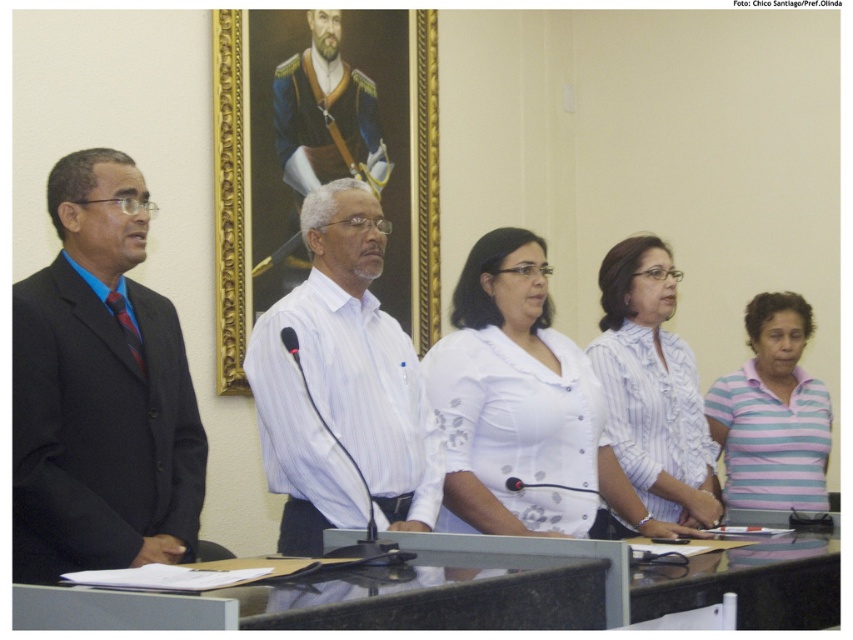
You are organizing a team photo and need to arrange two people wearing striped shirts in a specific order. The white striped shirt at center and the striped cotton shirt at lower right must be placed next to each other. According to the scene, which shirt should be on the left when arranging them from left to right?

The white striped shirt at center should be on the left side of the striped cotton shirt at lower right because the white striped shirt at center is positioned on the left side of striped cotton shirt at lower right in the original scene.